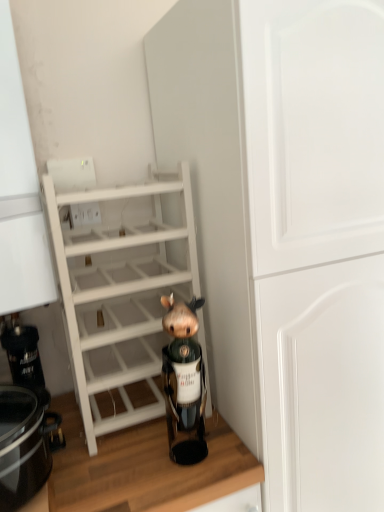
This screenshot has width=384, height=512. Find the location of `vacant area on the back side of black glossy crock pot at lower left`. vacant area on the back side of black glossy crock pot at lower left is located at coordinates (81, 424).